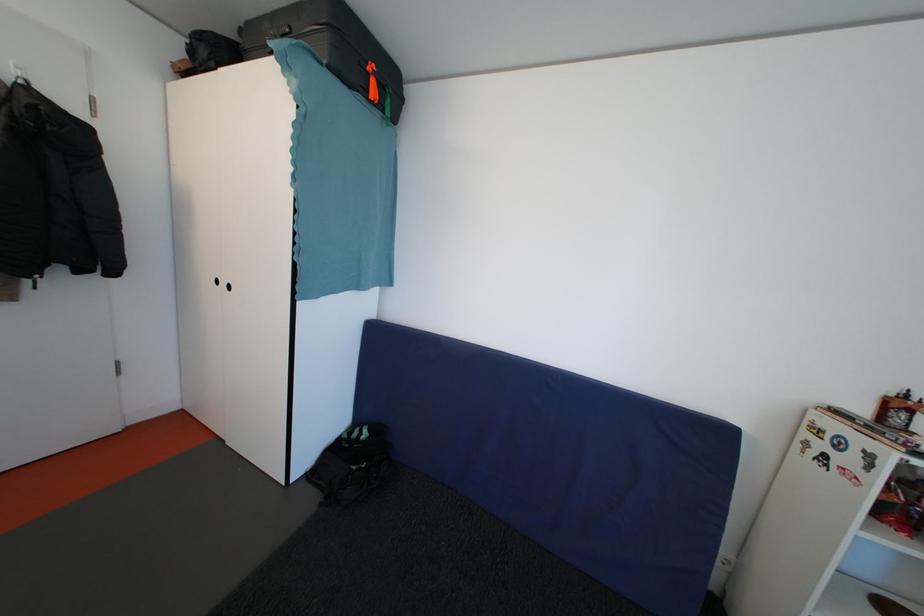
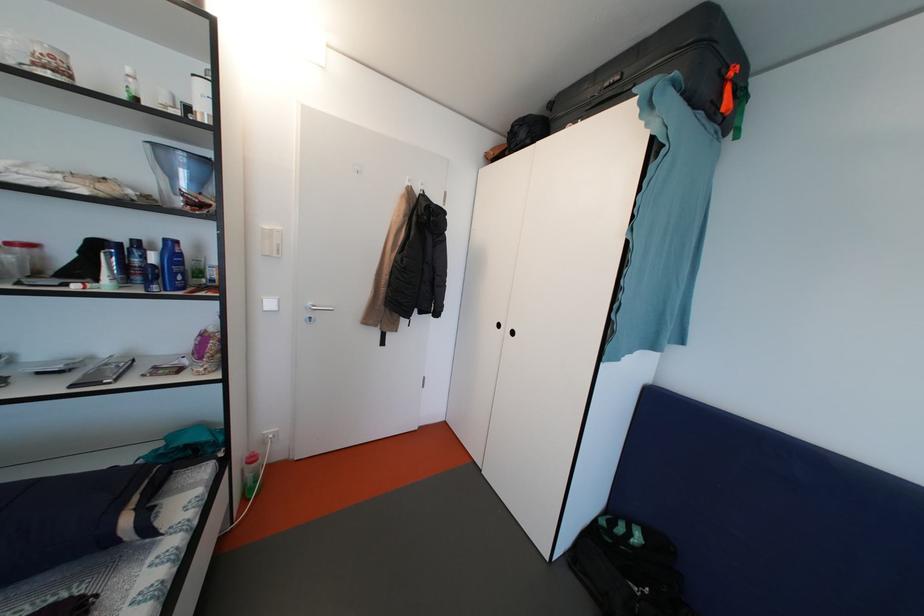
Question: The images are taken continuously from a first-person perspective. In which direction is your viewpoint rotating?

Choices:
 (A) Left
 (B) Right
 (C) Up
 (D) Down

Answer: (A)